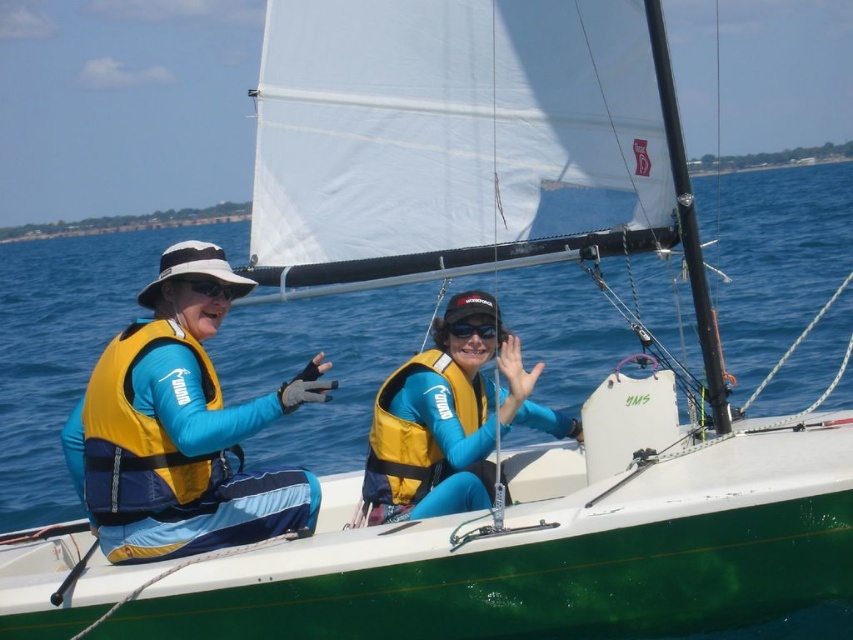
You are standing on a dock 20 feet away from the yellow fabric life vest at left. Can you safely reach it with a 2.5 foot long pole?

The yellow fabric life vest at left is 21.64 feet away from the viewer. Since the dock is 20 feet away, the pole would only extend to 22.5 feet, which is just enough to reach it. However, due to possible inaccuracies in measurement or movement, it might be challenging but technically possible.

You are a photographer taking a picture of the yellow life vest at center and the black matte goggles at center. Which object will appear larger in your photo?

The yellow life vest at center will appear larger in the photo because it is closer to the viewer than the black matte goggles at center.

You are a safety inspector checking the placement of life vests on a sailboat. The yellow fabric life vest at left and the yellow life jacket at center are both present. According to safety regulations, life vests must be placed to the right of the wearer for quick access. Which life vest is correctly positioned?

The yellow life jacket at center is correctly positioned because it is to the right of the yellow fabric life vest at left, aligning with the safety regulation requirement.